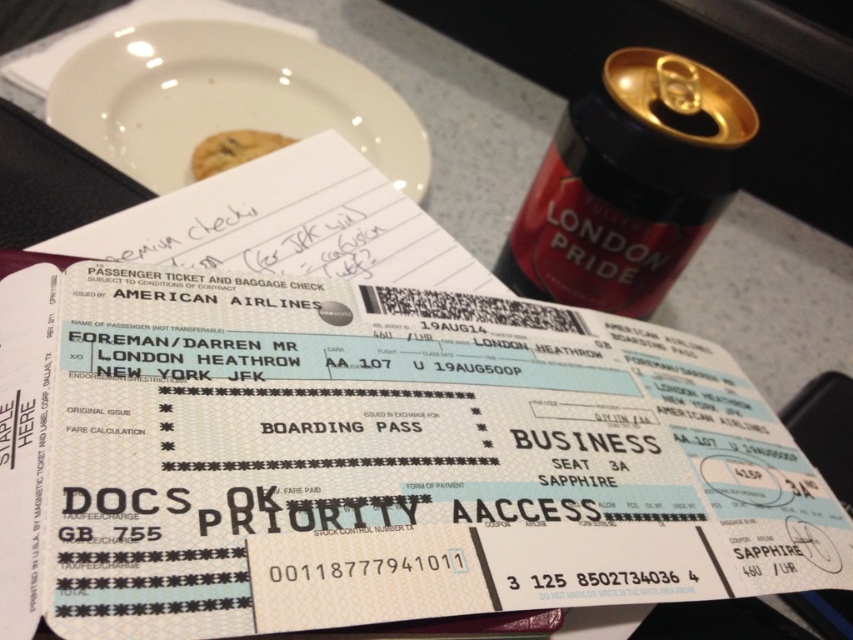
You are looking at the boarding passes and the note on the table. There are two points marked on the image, one at point [318,106] and another at point [219,157]. Which point is closer to you?

Point [318,106] is closer to you because it is further to the viewer than point [219,157].

You are at a table where there are two American Airlines boarding passes and a handwritten note. There is also a red matte can at upper right. A point is marked at coordinate (628, 184). Based on the scene, where is this point located?

The point at coordinate (628, 184) is located on the red matte can at upper right.

You are a travel agent arranging items on a table for a client. You have a red matte can at upper right and a white glossy plate at upper center. The client needs to place a 12 inch long travel document between them. Can the document fit between the two items?

The distance between the red matte can at upper right and the white glossy plate at upper center is 16.62 inches, so a 12 inch long travel document can fit between them since 12 is less than 16.62.